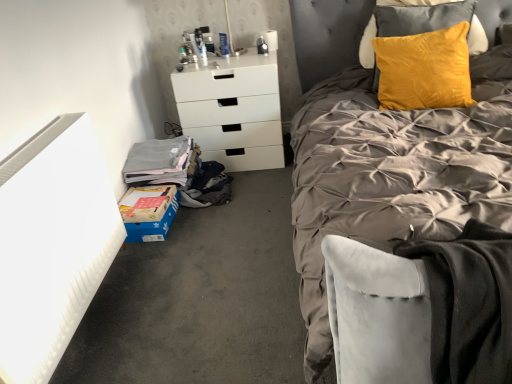
Question: From the image's perspective, would you say blue cardboard box at lower left is shown under yellow velvet pillow at upper right?

Choices:
 (A) no
 (B) yes

Answer: (B)

Question: Is blue cardboard box at lower left aimed at yellow velvet pillow at upper right?

Choices:
 (A) yes
 (B) no

Answer: (B)

Question: Is blue cardboard box at lower left further to camera compared to yellow velvet pillow at upper right?

Choices:
 (A) no
 (B) yes

Answer: (A)

Question: Is the depth of blue cardboard box at lower left less than that of yellow velvet pillow at upper right?

Choices:
 (A) no
 (B) yes

Answer: (B)

Question: Can you confirm if blue cardboard box at lower left is positioned to the right of yellow velvet pillow at upper right?

Choices:
 (A) no
 (B) yes

Answer: (A)

Question: Can you confirm if blue cardboard box at lower left is shorter than yellow velvet pillow at upper right?

Choices:
 (A) no
 (B) yes

Answer: (B)

Question: Is white matte chest of drawers at center aimed at yellow velvet pillow at upper right?

Choices:
 (A) yes
 (B) no

Answer: (B)

Question: From a real-world perspective, is white matte chest of drawers at center below yellow velvet pillow at upper right?

Choices:
 (A) yes
 (B) no

Answer: (A)

Question: Is white matte chest of drawers at center positioned with its back to yellow velvet pillow at upper right?

Choices:
 (A) yes
 (B) no

Answer: (B)

Question: Considering the relative positions of white matte chest of drawers at center and yellow velvet pillow at upper right in the image provided, is white matte chest of drawers at center to the right of yellow velvet pillow at upper right from the viewer's perspective?

Choices:
 (A) yes
 (B) no

Answer: (B)

Question: From the image's perspective, does white matte chest of drawers at center appear lower than yellow velvet pillow at upper right?

Choices:
 (A) yes
 (B) no

Answer: (A)

Question: Is white matte chest of drawers at center taller than yellow velvet pillow at upper right?

Choices:
 (A) no
 (B) yes

Answer: (B)

Question: Does blue cardboard box at lower left come in front of white matte chest of drawers at center?

Choices:
 (A) no
 (B) yes

Answer: (B)